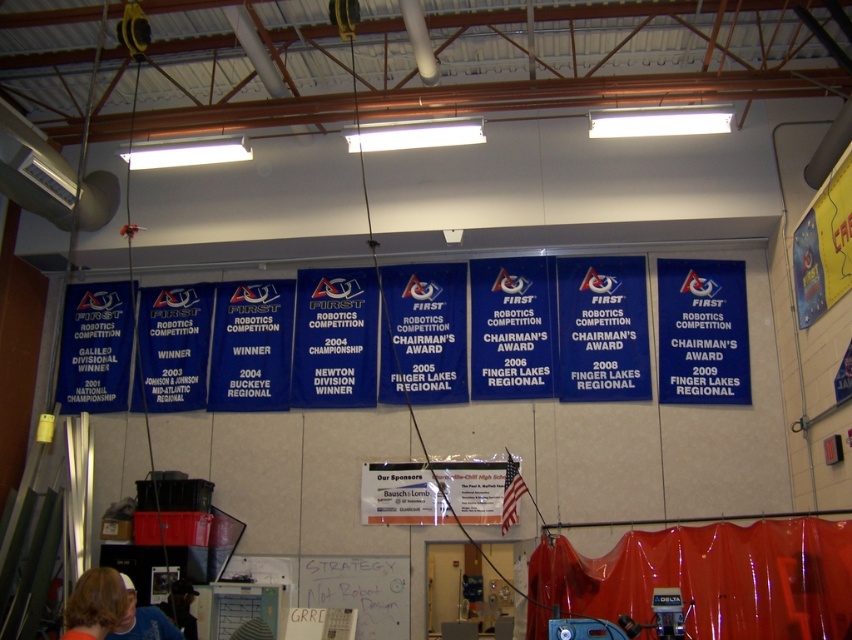
Based on the photo, is white paper at center to the left of matte black shirt at lower left from the viewer's perspective?

In fact, white paper at center is to the right of matte black shirt at lower left.

Does white paper at center have a lesser width compared to matte black shirt at lower left?

In fact, white paper at center might be wider than matte black shirt at lower left.

Who is more forward, (492, 488) or (170, 609)?

Positioned in front is point (170, 609).

This screenshot has width=852, height=640. Find the location of `white paper at center`. white paper at center is located at coordinates (432, 492).

Who is lower down, blonde hair at lower left or matte black shirt at lower left?

matte black shirt at lower left is below.

Does point (117, 605) come behind point (181, 589)?

No, (117, 605) is in front of (181, 589).

Does point (102, 614) come farther from viewer compared to point (183, 636)?

No, it is in front of (183, 636).

Where is `blonde hair at lower left`? blonde hair at lower left is located at coordinates (95, 604).

Does blue fabric banner at center-right have a greater width compared to blue t-shirt at lower left?

Yes, blue fabric banner at center-right is wider than blue t-shirt at lower left.

Where is `blue fabric banner at center-right`? The height and width of the screenshot is (640, 852). blue fabric banner at center-right is located at coordinates tap(701, 332).